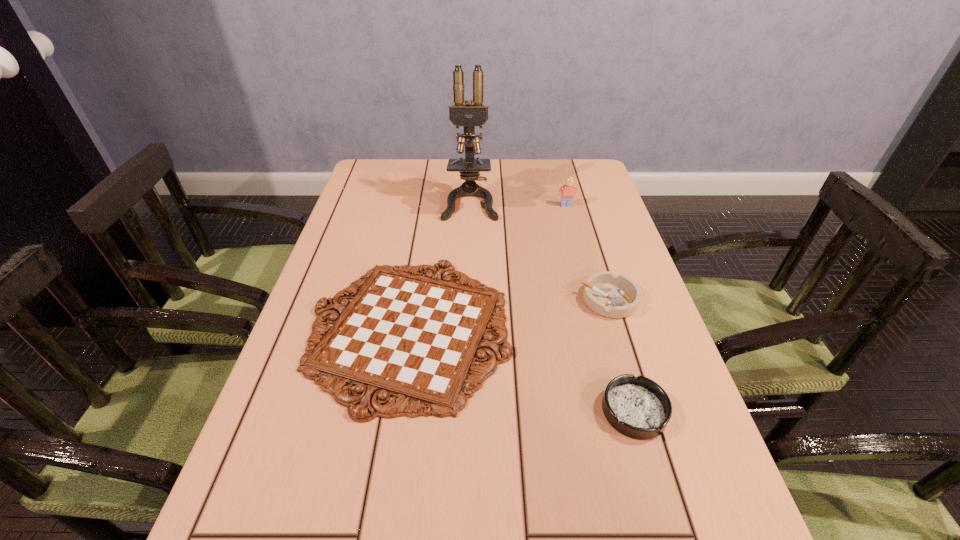
The width and height of the screenshot is (960, 540). What are the coordinates of `blank region between the farther ashtray and the nearer ashtray` in the screenshot? It's located at pyautogui.click(x=621, y=355).

You are a GUI agent. You are given a task and a screenshot of the screen. Output one action in this format:
    pyautogui.click(x=<x>, y=<y>)
    Task: Click on the empty location between the farther ashtray and the shortest object
    The width and height of the screenshot is (960, 540).
    Given the screenshot: What is the action you would take?
    pyautogui.click(x=509, y=315)

Identify the location of vacant area that lies between the tallest object and the nearer ashtray. (552, 306).

Find the location of a particular element. This screenshot has width=960, height=540. the second closest object to the Lego is located at coordinates (416, 338).

Select which object is the fourth closest to the microscope. Please provide its 2D coordinates. Your answer should be formatted as a tuple, i.e. [(x, y)], where the tuple contains the x and y coordinates of a point satisfying the conditions above.

[(637, 407)]

Image resolution: width=960 pixels, height=540 pixels. Identify the location of free region that satisfies the following two spatial constraints: 1. on the front-facing side of the nearer ashtray; 2. on the left side of the fourth shortest object. (620, 411).

I want to click on vacant space that satisfies the following two spatial constraints: 1. at the eyepieces of the microscope; 2. on the left side of the farther ashtray, so click(468, 300).

Find the location of a particular element. Image resolution: width=960 pixels, height=540 pixels. free spot that satisfies the following two spatial constraints: 1. on the front-facing side of the Lego; 2. on the right side of the farther ashtray is located at coordinates (591, 300).

Identify the location of vacant area that satisfies the following two spatial constraints: 1. at the eyepieces of the nearer ashtray; 2. on the left side of the microscope. The image size is (960, 540). (464, 411).

Where is `free space that satisfies the following two spatial constraints: 1. at the eyepieces of the microscope; 2. on the right side of the nearer ashtray`? The height and width of the screenshot is (540, 960). free space that satisfies the following two spatial constraints: 1. at the eyepieces of the microscope; 2. on the right side of the nearer ashtray is located at coordinates (464, 411).